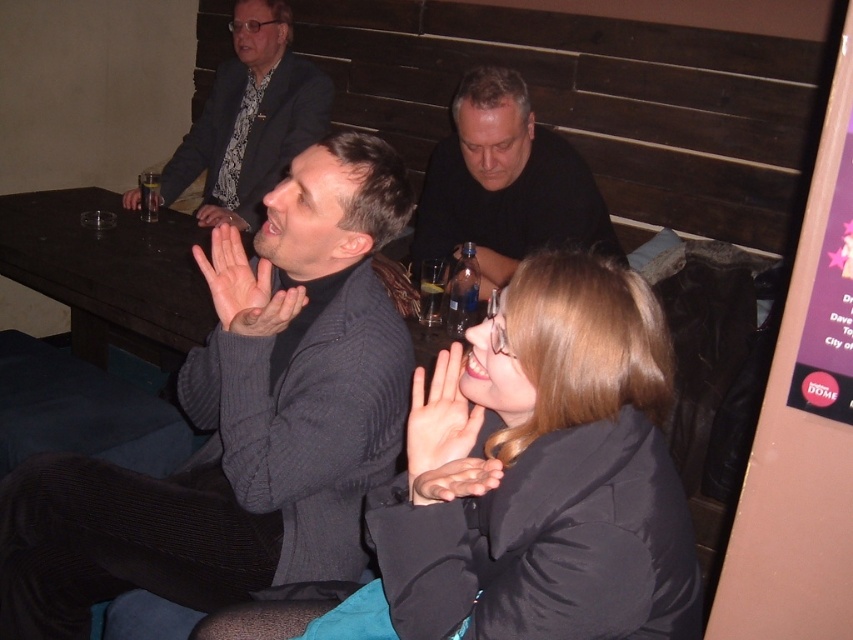
Question: Is dark gray sweater at center positioned at the back of black matte shirt at center?

Choices:
 (A) no
 (B) yes

Answer: (A)

Question: Does black matte shirt at center appear over light skin tone flesh at center?

Choices:
 (A) no
 (B) yes

Answer: (B)

Question: Among these points, which one is nearest to the camera?

Choices:
 (A) (558, 225)
 (B) (310, 516)
 (C) (97, 358)
 (D) (234, 67)

Answer: (B)

Question: Which of the following is the farthest from the observer?

Choices:
 (A) dark gray sweater at center
 (B) dark wood table at center
 (C) black matte jacket at center

Answer: (B)

Question: Which of the following is the closest to the observer?

Choices:
 (A) dark blue suit at upper left
 (B) dark gray sweater at center

Answer: (B)

Question: Does dark gray sweater at center appear under dark blue suit at upper left?

Choices:
 (A) yes
 (B) no

Answer: (A)